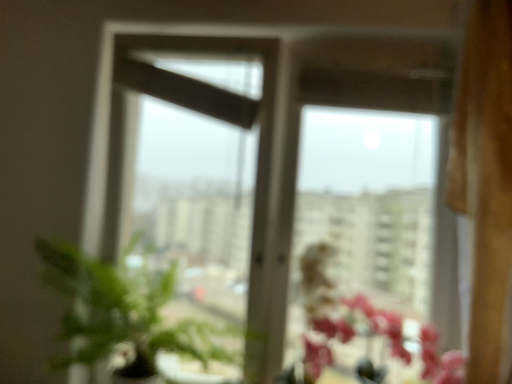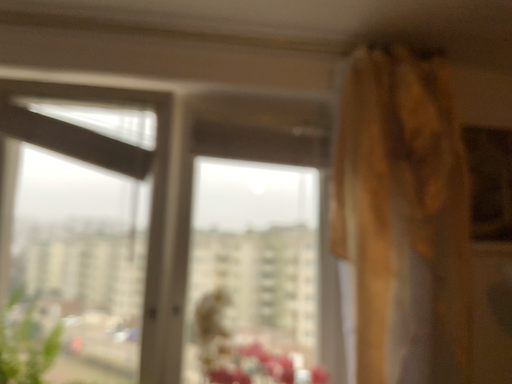
Question: How did the camera likely rotate when shooting the video?

Choices:
 (A) rotated right
 (B) rotated left

Answer: (A)